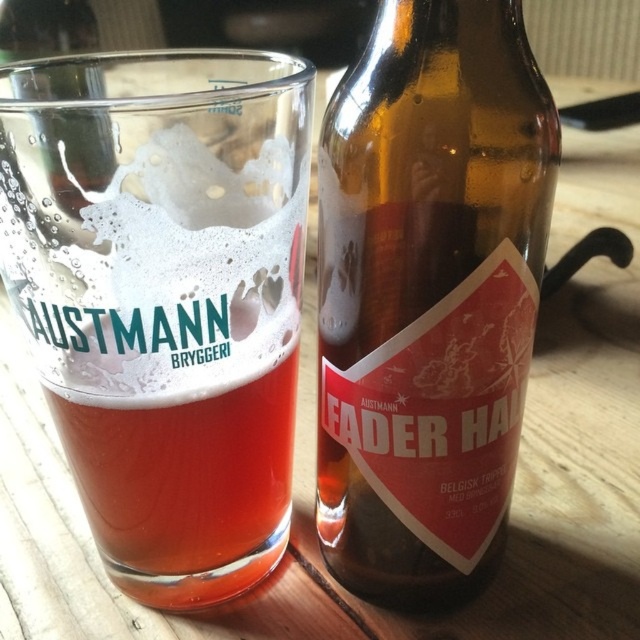
Question: Which is farther from the brown glass bottle at right?

Choices:
 (A) transparent glass bottle at center
 (B) clear glass beer at center

Answer: (A)

Question: Estimate the real-world distances between objects in this image. Which object is farther from the brown glass bottle at right?

Choices:
 (A) clear glass beer at center
 (B) transparent glass bottle at center

Answer: (B)

Question: Does clear glass beer at center appear on the right side of transparent glass bottle at center?

Choices:
 (A) yes
 (B) no

Answer: (A)

Question: Estimate the real-world distances between objects in this image. Which object is farther from the transparent glass bottle at center?

Choices:
 (A) clear glass beer at center
 (B) brown glass bottle at right

Answer: (B)

Question: Can you confirm if clear glass beer at center is wider than transparent glass bottle at center?

Choices:
 (A) no
 (B) yes

Answer: (B)

Question: Can you confirm if clear glass beer at center is positioned to the left of transparent glass bottle at center?

Choices:
 (A) yes
 (B) no

Answer: (B)